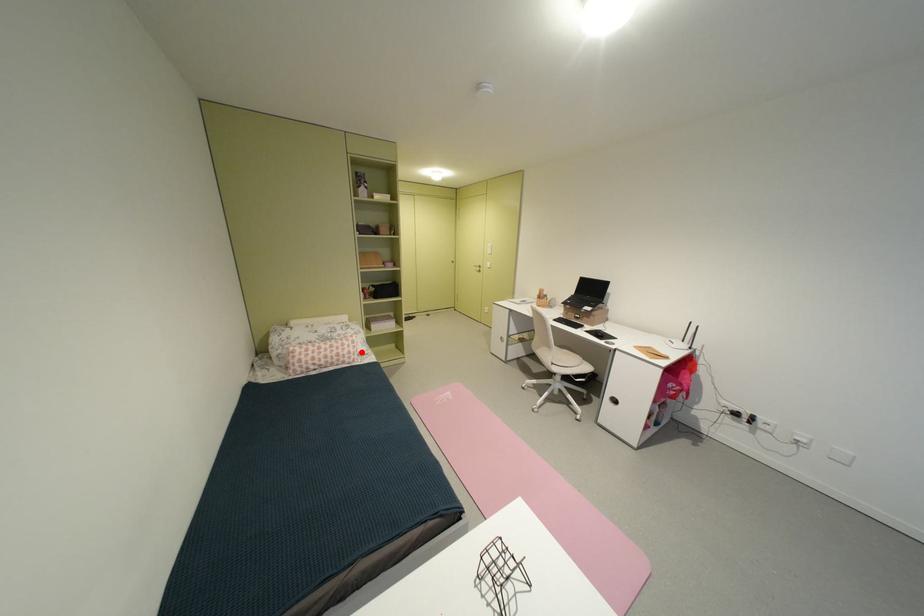
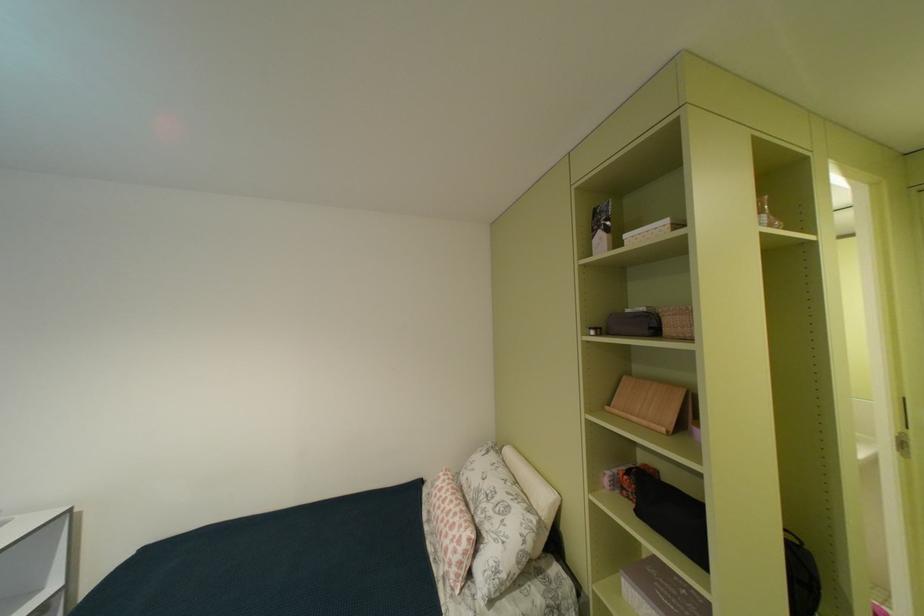
In the second image, find the point that corresponds to the highlighted location in the first image.

(458, 556)